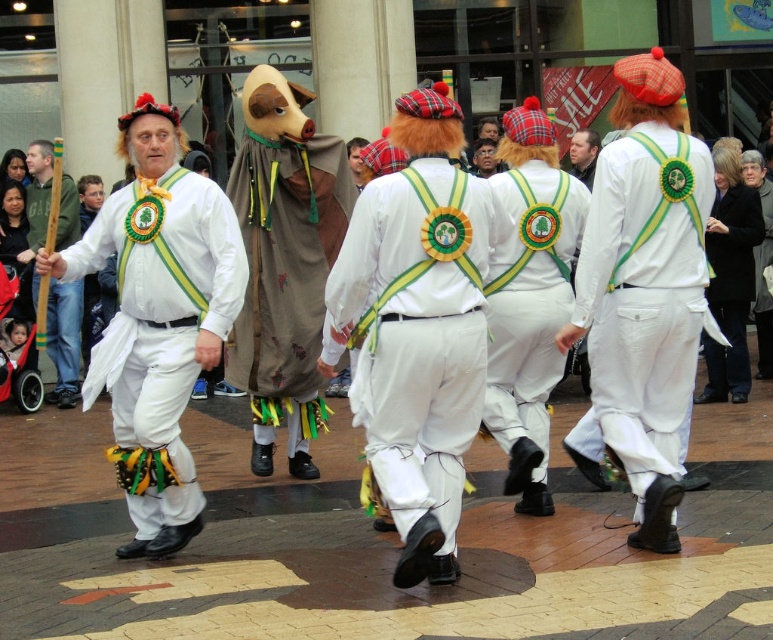
Question: Which is farther from the wooden stick at left?

Choices:
 (A) white matte pants at center
 (B) brown fabric mask at center
 (C) white matte/soft fabric pants at left
 (D) black wool coat at right

Answer: (A)

Question: Among these objects, which one is nearest to the camera?

Choices:
 (A) brown fabric mask at center
 (B) white matte vest at center
 (C) white matte fabric at center
 (D) white matte pants at center

Answer: (C)

Question: Can you confirm if brown fabric mask at center is wider than wooden stick at left?

Choices:
 (A) no
 (B) yes

Answer: (A)

Question: Considering the relative positions of white matte vest at center and white matte pants at center in the image provided, where is white matte vest at center located with respect to white matte pants at center?

Choices:
 (A) right
 (B) left

Answer: (B)

Question: In this image, where is black wool coat at right located relative to white matte pants at center?

Choices:
 (A) above
 (B) below

Answer: (A)

Question: Which of the following is the closest to the observer?

Choices:
 (A) white matte vest at center
 (B) black wool coat at right

Answer: (A)